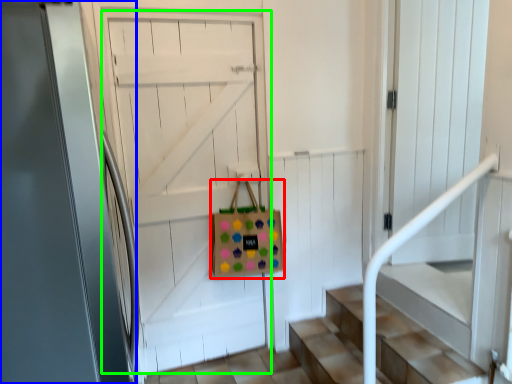
Question: Considering the real-world distances, which object is closest to shopping bag (highlighted by a red box)? door (highlighted by a blue box) or door (highlighted by a green box).

Choices:
 (A) door
 (B) door

Answer: (B)